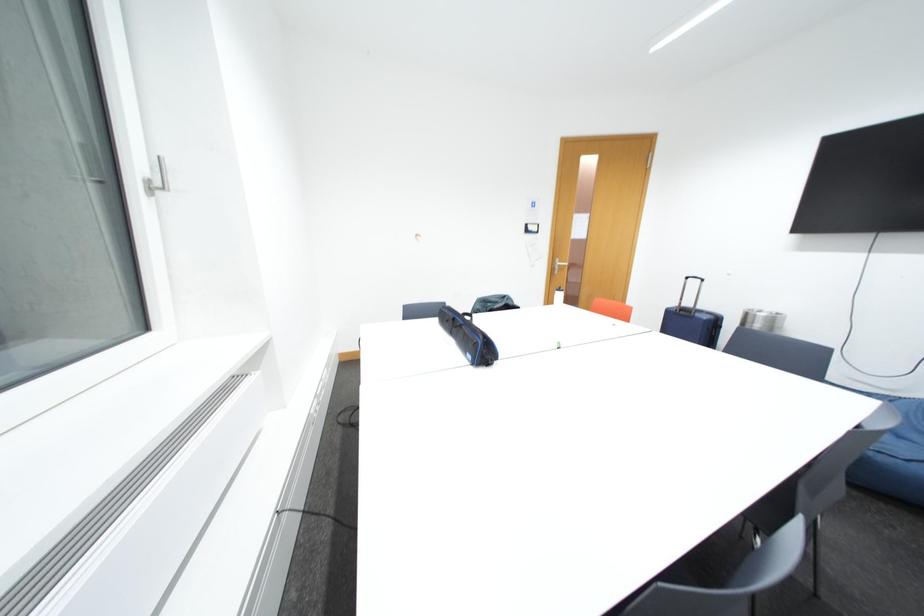
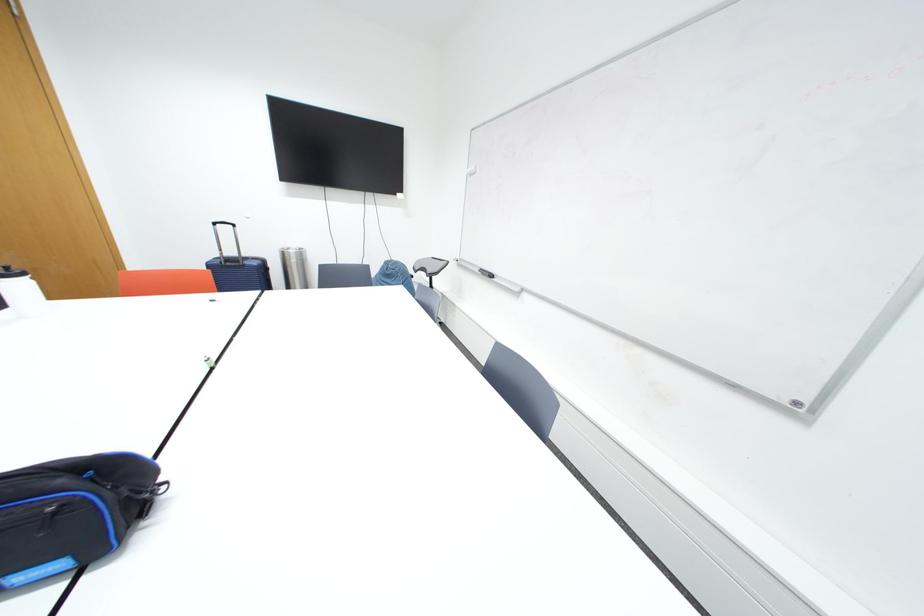
Based on the continuous images, in which direction is the camera rotating?

The camera rotated toward right-down.